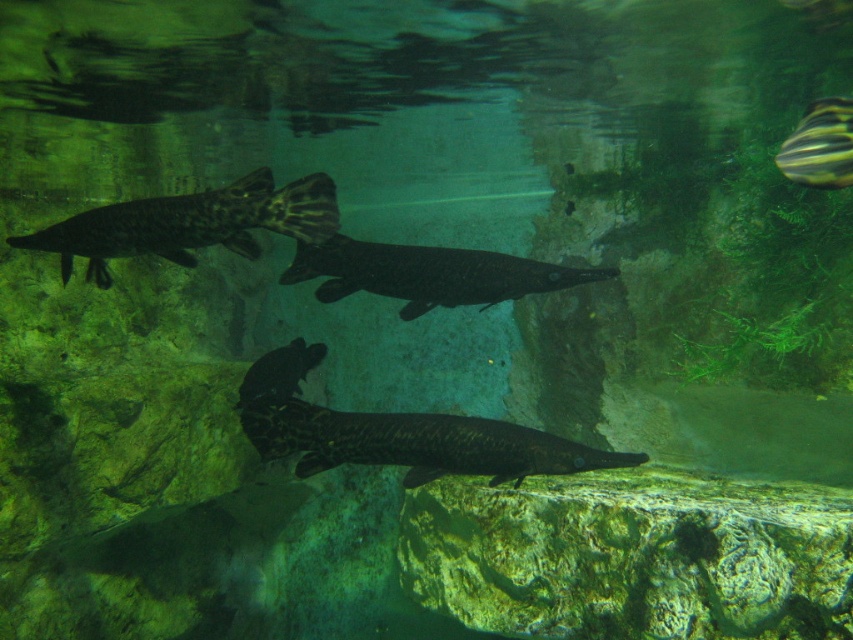
Which is more to the right, dark spotted fish at center or shiny black fish at center?

dark spotted fish at center

Between dark spotted fish at center and shiny black fish at center, which one appears on the left side from the viewer's perspective?

From the viewer's perspective, shiny black fish at center appears more on the left side.

Describe the element at coordinates (416, 442) in the screenshot. I see `dark spotted fish at center` at that location.

I want to click on dark spotted fish at center, so click(x=416, y=442).

Which is below, dark brown textured fish at upper left or dark gray matte fish at center?

Positioned lower is dark gray matte fish at center.

Does dark brown textured fish at upper left appear over dark gray matte fish at center?

Yes, dark brown textured fish at upper left is above dark gray matte fish at center.

The height and width of the screenshot is (640, 853). Describe the element at coordinates (190, 224) in the screenshot. I see `dark brown textured fish at upper left` at that location.

Locate an element on the screen. The height and width of the screenshot is (640, 853). dark brown textured fish at upper left is located at coordinates (190, 224).

Is dark spotted fish at center below striped yellow-black fish at upper right?

Correct, dark spotted fish at center is located below striped yellow-black fish at upper right.

Between dark spotted fish at center and striped yellow-black fish at upper right, which one appears on the right side from the viewer's perspective?

From the viewer's perspective, striped yellow-black fish at upper right appears more on the right side.

The height and width of the screenshot is (640, 853). What do you see at coordinates (416, 442) in the screenshot?
I see `dark spotted fish at center` at bounding box center [416, 442].

I want to click on dark spotted fish at center, so click(x=416, y=442).